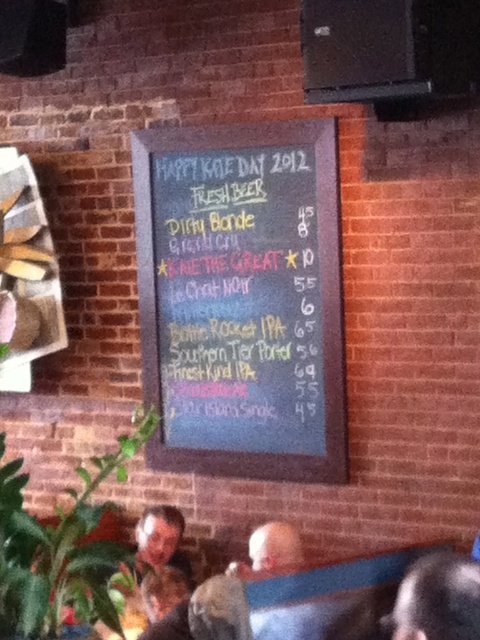
Question: Is dark brown hair at lower right to the left of gray fabric shirt at lower center from the viewer's perspective?

Choices:
 (A) no
 (B) yes

Answer: (A)

Question: Which object is the closest to the black chalkboard at center?

Choices:
 (A) dark brown hair at lower right
 (B) gray fabric shirt at lower center

Answer: (B)

Question: From the image, what is the correct spatial relationship of black chalkboard at center in relation to gray fabric shirt at lower center?

Choices:
 (A) right
 (B) left

Answer: (B)

Question: From the image, what is the correct spatial relationship of black chalkboard at center in relation to gray fabric shirt at lower center?

Choices:
 (A) above
 (B) below

Answer: (A)

Question: Which object is closer to the camera taking this photo?

Choices:
 (A) black chalkboard at center
 (B) gray fabric shirt at lower center

Answer: (B)

Question: Which point is farther to the camera?

Choices:
 (A) gray fabric shirt at lower center
 (B) black chalkboard at center

Answer: (B)